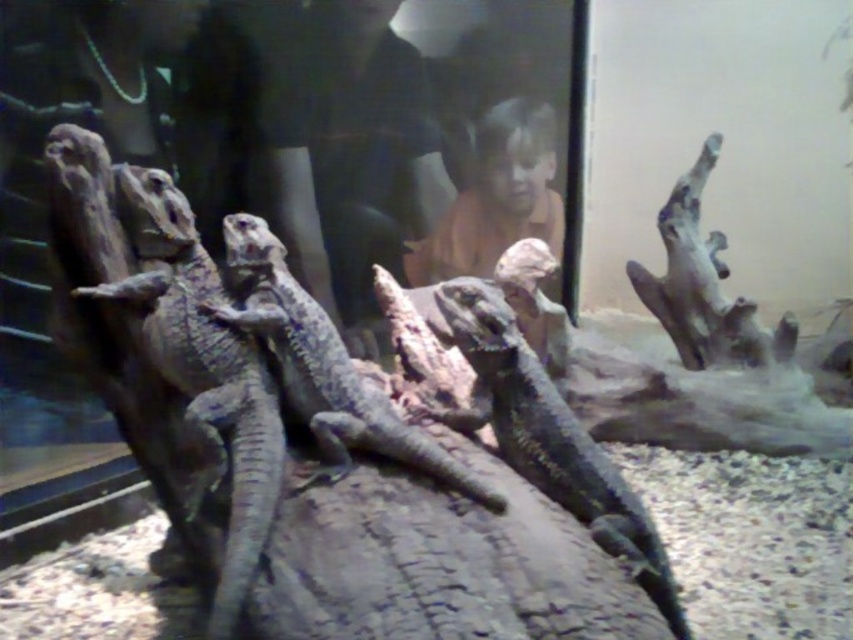
You are a zookeeper standing in front of the enclosure. You need to reach the shiny black lizard at center to feed it. Can you safely extend your hand through the glass barrier to touch it without stretching too far? The average human arm length is about 2.5 feet.

The distance between the shiny black lizard at center and the viewer is 7.48 feet. Since the average human arm length is 2.5 feet, you cannot safely reach the lizard without stretching too far.

You are a zookeeper who needs to place a new heat lamp in the enclosure. The lamp has a coverage radius of 1 meter. If you position the lamp directly above the shiny black lizard at center, will it also provide sufficient heat to the scaly gray lizard at left?

The distance between the scaly gray lizard at left and the shiny black lizard at center is 95.32 centimeters. Since the lamp has a coverage radius of 1 meter, which is 100 centimeters, the heat will reach the scaly gray lizard at left as the distance is within the coverage area.